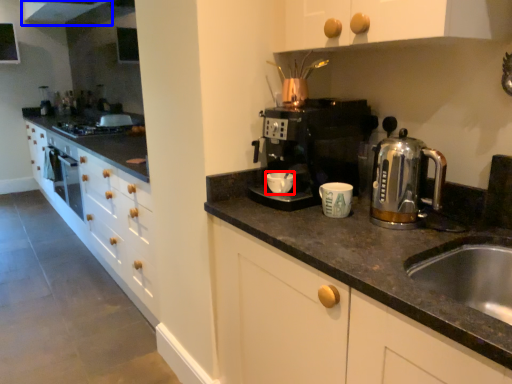
Question: Which point is further to the camera, mug (highlighted by a red box) or exhaust hood (highlighted by a blue box)?

Choices:
 (A) mug
 (B) exhaust hood

Answer: (B)